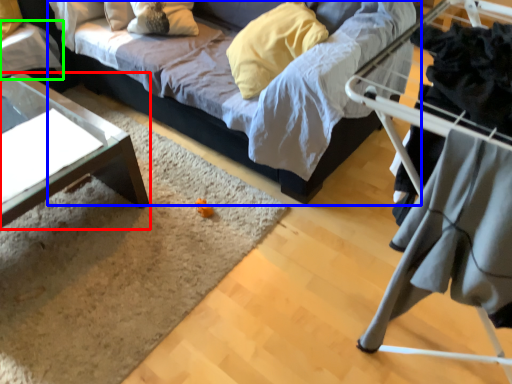
Question: Which object is positioned farthest from table (highlighted by a red box)? Select from studio couch (highlighted by a blue box) and table (highlighted by a green box).

Choices:
 (A) studio couch
 (B) table

Answer: (A)